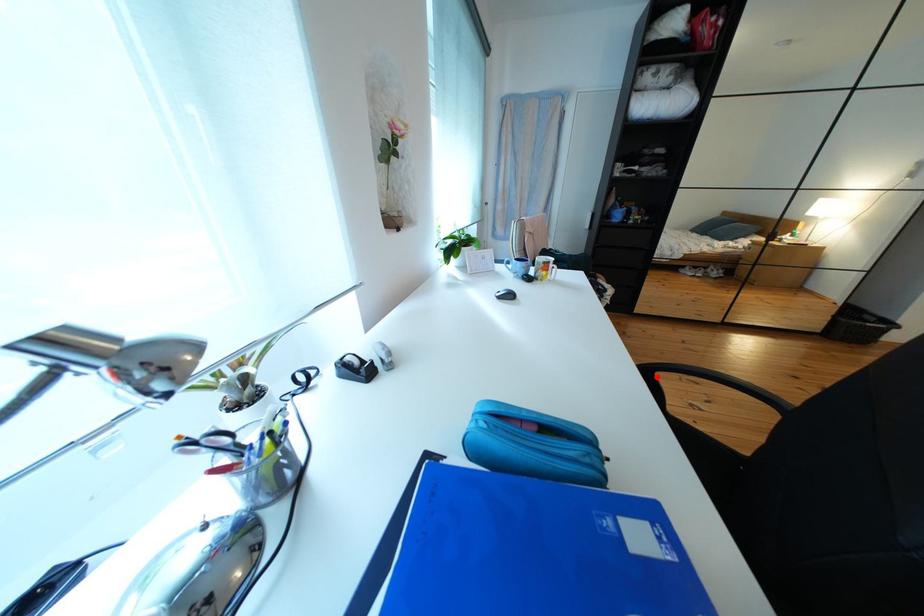
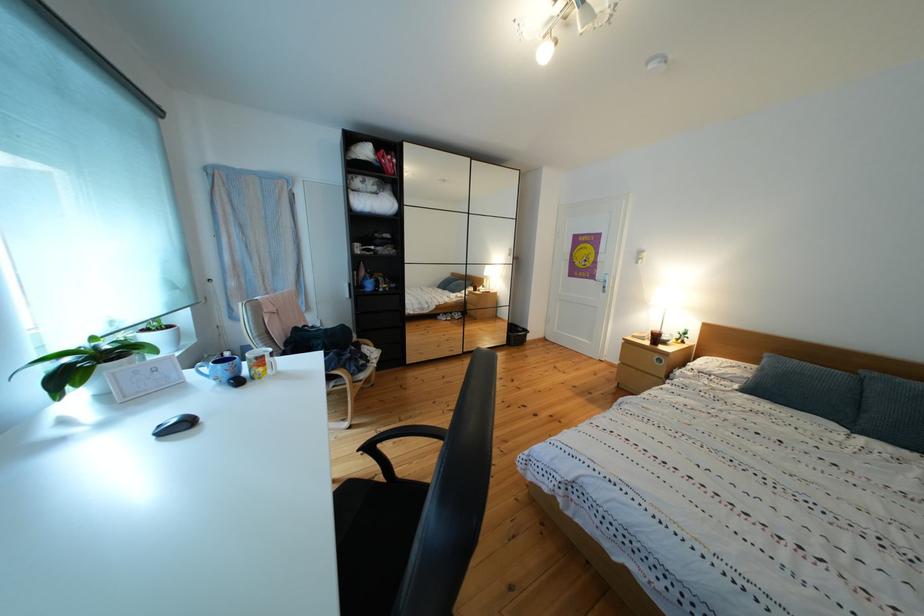
Question: I am providing you with two images of the same scene from different viewpoints. Image1 has a red point marked. In image2, the corresponding 3D location appears at what relative position? Reply with the corresponding letter.

Choices:
 (A) Closer
 (B) Farther

Answer: (A)